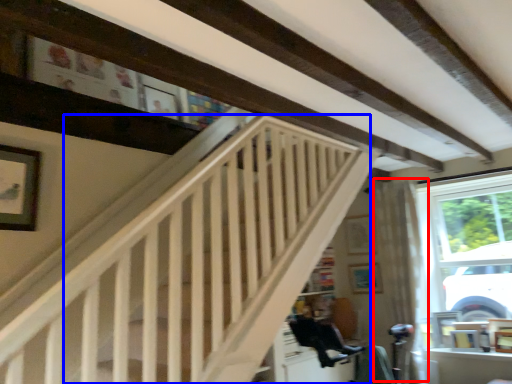
Question: Which point is further to the camera, curtain (highlighted by a red box) or stairwell (highlighted by a blue box)?

Choices:
 (A) curtain
 (B) stairwell

Answer: (A)